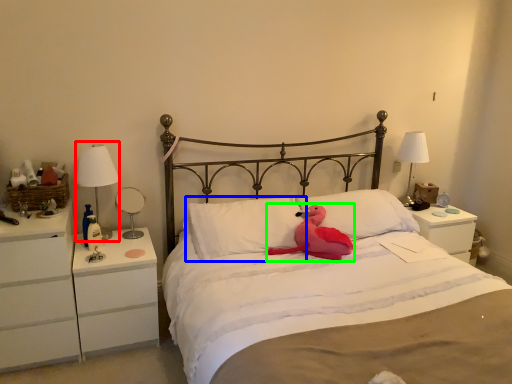
Question: Considering the real-world distances, which object is closest to bedside lamp (highlighted by a red box)? pillow (highlighted by a blue box) or animal (highlighted by a green box).

Choices:
 (A) pillow
 (B) animal

Answer: (A)